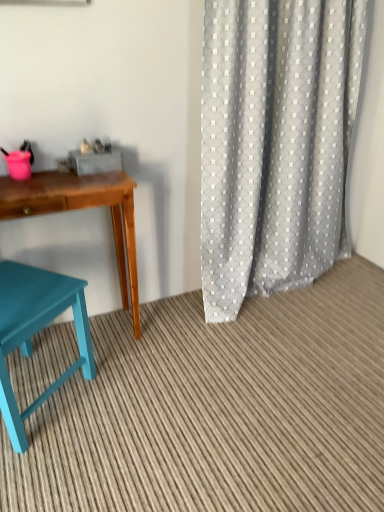
Locate an element on the screen. This screenshot has width=384, height=512. empty space that is to the right of teal painted wood chair at lower left is located at coordinates (129, 405).